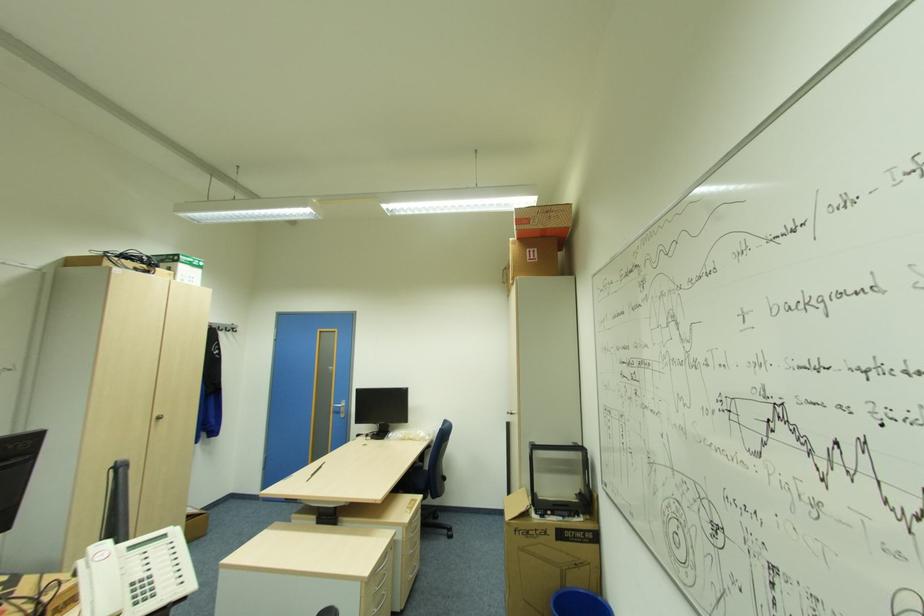
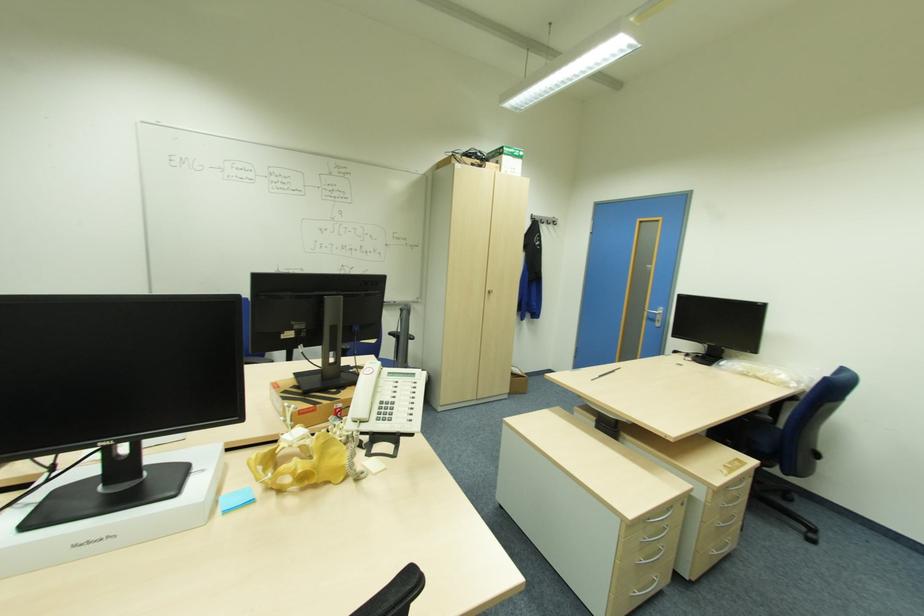
Locate, in the second image, the point that corresponds to (388,556) in the first image.

(672, 511)